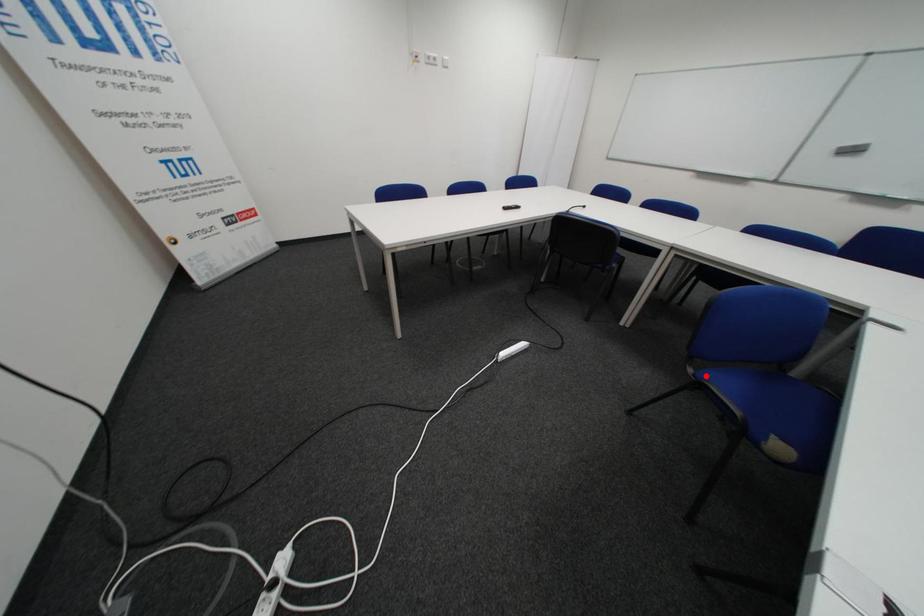
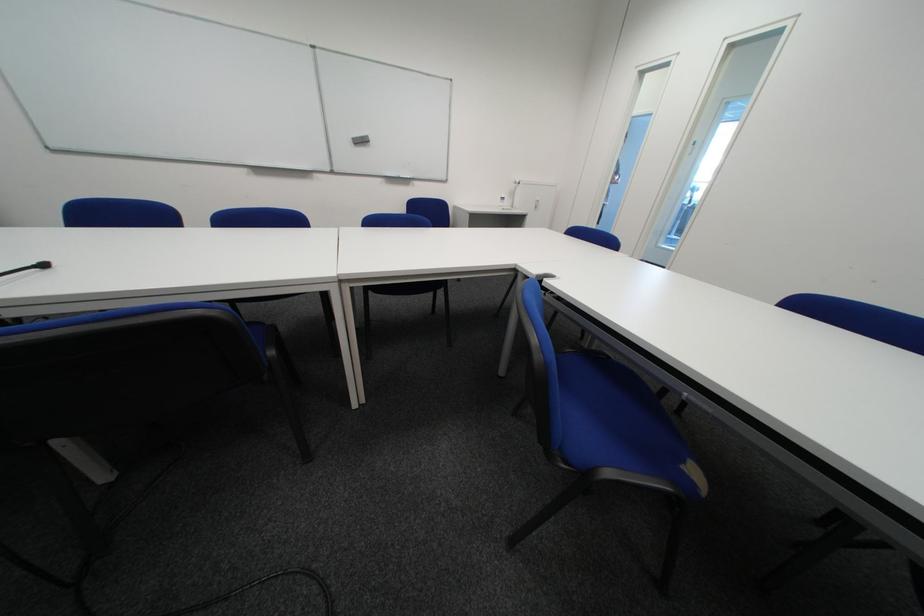
Question: I am providing you with two images of the same scene from different viewpoints. A red point is marked on the first image. At the location where the point appears in image 1, is it still visible in image 2?

Choices:
 (A) Yes
 (B) No

Answer: (A)